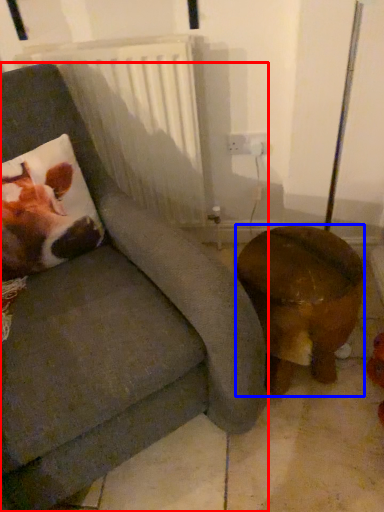
Question: Among these objects, which one is nearest to the camera, chair (highlighted by a red box) or furniture (highlighted by a blue box)?

Choices:
 (A) chair
 (B) furniture

Answer: (A)